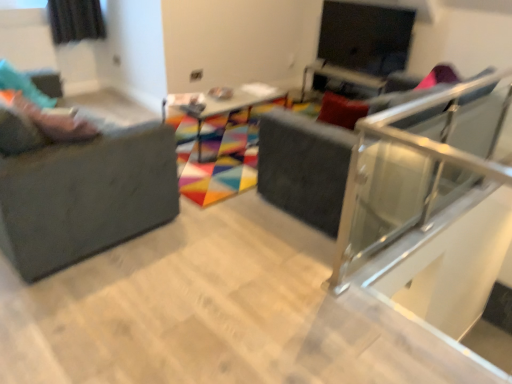
This screenshot has height=384, width=512. Describe the element at coordinates (304, 167) in the screenshot. I see `matte black swivel chair at center` at that location.

Image resolution: width=512 pixels, height=384 pixels. Describe the element at coordinates (365, 36) in the screenshot. I see `matte black screen at upper right` at that location.

What do you see at coordinates (221, 105) in the screenshot?
I see `wooden table at center` at bounding box center [221, 105].

At what (x,y) coordinates should I click in order to perform the action: click on wooden table at center. Please return your answer as a coordinate pair (x, y). Looking at the image, I should click on [x=221, y=105].

Locate an element on the screen. This screenshot has height=384, width=512. matte black swivel chair at center is located at coordinates (304, 167).

Is wooden table at center completely or partially outside of matte black swivel chair at center?

Yes, wooden table at center is outside of matte black swivel chair at center.

Is wooden table at center positioned with its back to matte black swivel chair at center?

That's not correct — wooden table at center is not looking away from matte black swivel chair at center.

From a real-world perspective, which is physically above, wooden table at center or matte black swivel chair at center?

From a 3D spatial view, matte black swivel chair at center is above.

Considering the points (250, 100) and (349, 156), which point is in front, point (250, 100) or point (349, 156)?

Positioned in front is point (349, 156).

The height and width of the screenshot is (384, 512). Find the location of `studio couch in front of the matte black screen at upper right`. studio couch in front of the matte black screen at upper right is located at coordinates (86, 190).

Is matte gray studio couch at left located within matte black screen at upper right?

No, matte gray studio couch at left is not a part of matte black screen at upper right.

Would you consider matte black screen at upper right to be distant from matte gray studio couch at left?

Yes.

Which of these two, matte black screen at upper right or matte gray studio couch at left, stands taller?

Standing taller between the two is matte gray studio couch at left.

Can you confirm if wooden table at center is thinner than matte black screen at upper right?

No.

Which object is positioned more to the right, wooden table at center or matte black screen at upper right?

From the viewer's perspective, matte black screen at upper right appears more on the right side.

There is a wooden table at center. Identify the location of window screen above it (from a real-world perspective). (365, 36).

Which object is positioned more to the right, matte black screen at upper right or matte black swivel chair at center?

From the viewer's perspective, matte black screen at upper right appears more on the right side.

Could matte black swivel chair at center be considered to be inside matte black screen at upper right?

No, matte black swivel chair at center is located outside of matte black screen at upper right.

Is matte black screen at upper right smaller than matte black swivel chair at center?

Yes, matte black screen at upper right is smaller than matte black swivel chair at center.

Does matte black screen at upper right turn towards matte black swivel chair at center?

No, matte black screen at upper right does not turn towards matte black swivel chair at center.

Looking at this image, does matte gray studio couch at left contain matte black screen at upper right?

No, matte black screen at upper right is not inside matte gray studio couch at left.

Between matte gray studio couch at left and matte black screen at upper right, which one has smaller size?

Smaller between the two is matte black screen at upper right.

Could you tell me if matte gray studio couch at left is turned towards matte black screen at upper right?

Yes, matte gray studio couch at left faces towards matte black screen at upper right.

Does point (9, 239) appear closer or farther from the camera than point (386, 71)?

Point (9, 239) is closer to the camera than point (386, 71).

From the image's perspective, between matte pink shoes at left and wooden table at center, which one is located above?

wooden table at center appears higher in the image.

Considering the sizes of matte pink shoes at left and wooden table at center in the image, is matte pink shoes at left taller or shorter than wooden table at center?

Considering their sizes, matte pink shoes at left has less height than wooden table at center.

In order to click on table above the matte pink shoes at left (from the image's perspective) in this screenshot , I will do `click(221, 105)`.

Can we say matte pink shoes at left lies outside wooden table at center?

That's correct, matte pink shoes at left is outside of wooden table at center.

Where is `table located above the matte gray studio couch at left (from the image's perspective)`? Image resolution: width=512 pixels, height=384 pixels. table located above the matte gray studio couch at left (from the image's perspective) is located at coordinates (221, 105).

Which object is closer to the camera taking this photo, matte gray studio couch at left or wooden table at center?

matte gray studio couch at left is more forward.

Between matte gray studio couch at left and wooden table at center, which one appears on the right side from the viewer's perspective?

wooden table at center is more to the right.

Considering the sizes of objects matte gray studio couch at left and wooden table at center in the image provided, who is bigger, matte gray studio couch at left or wooden table at center?

matte gray studio couch at left.

Where is `table that is on the left side of matte black swivel chair at center`? Image resolution: width=512 pixels, height=384 pixels. table that is on the left side of matte black swivel chair at center is located at coordinates (221, 105).

Where is `studio couch below the matte black screen at upper right (from a real-world perspective)`? The width and height of the screenshot is (512, 384). studio couch below the matte black screen at upper right (from a real-world perspective) is located at coordinates (86, 190).

When comparing their distances from matte black screen at upper right, does matte gray studio couch at left or matte pink shoes at left seem closer?

Among the two, matte gray studio couch at left is located nearer to matte black screen at upper right.

Estimate the real-world distances between objects in this image. Which object is closer to matte black screen at upper right, matte black swivel chair at center or wooden table at center?

wooden table at center.

Looking at the image, which one is located further to matte gray studio couch at left, matte pink shoes at left or wooden table at center?

wooden table at center is further to matte gray studio couch at left.

Considering their positions, is matte black swivel chair at center positioned further to wooden table at center than matte gray studio couch at left?

matte gray studio couch at left.

When comparing their distances from wooden table at center, does matte black swivel chair at center or matte pink shoes at left seem further?

Based on the image, matte pink shoes at left appears to be further to wooden table at center.

From the image, which object appears to be nearer to matte gray studio couch at left, matte pink shoes at left or matte black swivel chair at center?

matte pink shoes at left is closer to matte gray studio couch at left.

Looking at the image, which one is located closer to matte black swivel chair at center, matte pink shoes at left or wooden table at center?

The object closer to matte black swivel chair at center is wooden table at center.

Looking at the image, which one is located further to matte pink shoes at left, matte black screen at upper right or matte gray studio couch at left?

matte black screen at upper right is positioned further to the anchor matte pink shoes at left.

Where is `person situated between matte gray studio couch at left and matte black swivel chair at center from left to right`? This screenshot has width=512, height=384. person situated between matte gray studio couch at left and matte black swivel chair at center from left to right is located at coordinates (42, 107).

Identify the location of table between matte gray studio couch at left and matte black swivel chair at center from left to right. (221, 105).

Identify the location of table between matte pink shoes at left and matte black screen at upper right from left to right. This screenshot has width=512, height=384. (221, 105).

I want to click on swivel chair situated between matte gray studio couch at left and matte black screen at upper right from left to right, so click(x=304, y=167).